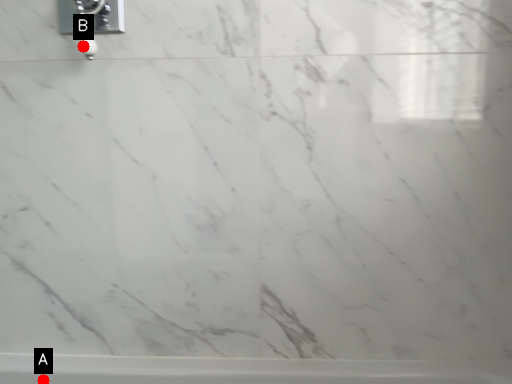
Question: Two points are circled on the image, labeled by A and B beside each circle. Which point is closer to the camera?

Choices:
 (A) A is closer
 (B) B is closer

Answer: (B)